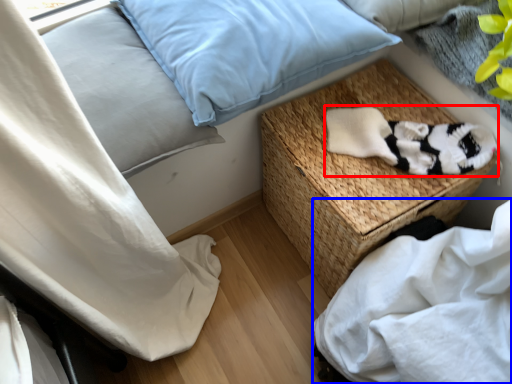
Question: Which object is further to the camera taking this photo, material (highlighted by a red box) or sheet (highlighted by a blue box)?

Choices:
 (A) material
 (B) sheet

Answer: (A)